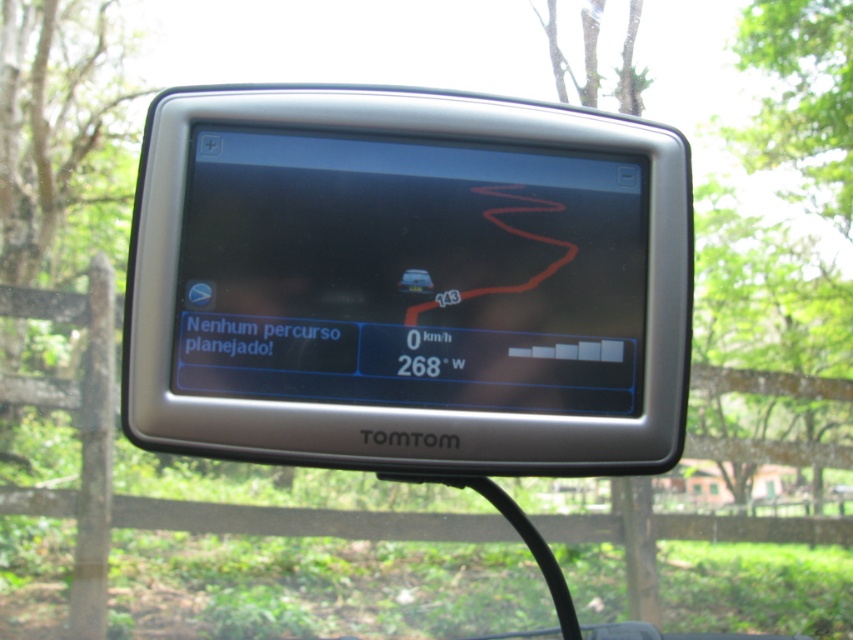
Question: Considering the relative positions of silver plastic gps at center and matte black car at center in the image provided, where is silver plastic gps at center located with respect to matte black car at center?

Choices:
 (A) above
 (B) below

Answer: (A)

Question: Is silver plastic gps at center closer to the viewer compared to matte black car at center?

Choices:
 (A) yes
 (B) no

Answer: (A)

Question: In this image, where is silver plastic gps at center located relative to matte black car at center?

Choices:
 (A) right
 (B) left

Answer: (A)

Question: Among these objects, which one is farthest from the camera?

Choices:
 (A) silver plastic gps at center
 (B) matte black car at center

Answer: (B)